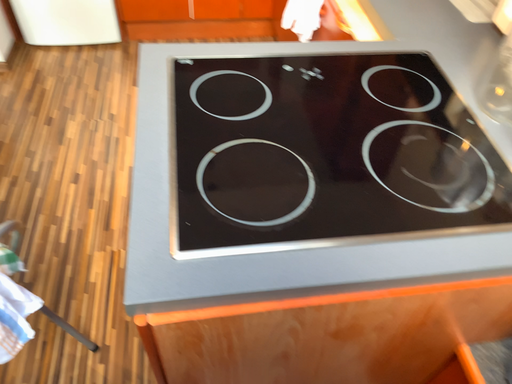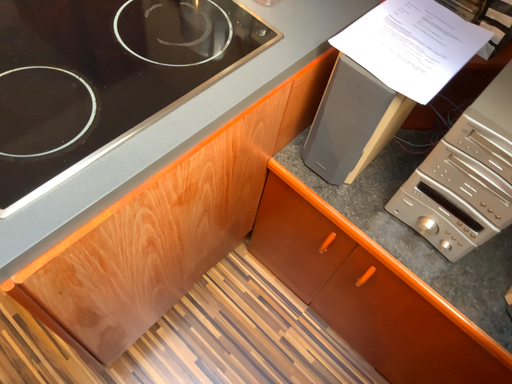
Question: Which way did the camera rotate in the video?

Choices:
 (A) rotated left
 (B) rotated right

Answer: (B)